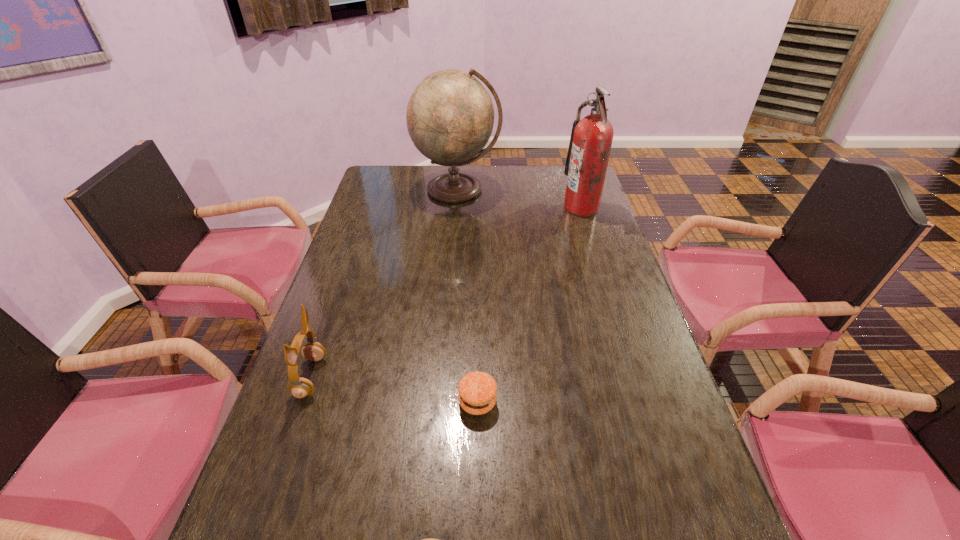
At what (x,y) coordinates should I click in order to perform the action: click on globe. Please return your answer as a coordinate pair (x, y). The image size is (960, 540). Looking at the image, I should click on (450, 115).

At what (x,y) coordinates should I click in order to perform the action: click on the rightmost object. Please return your answer as a coordinate pair (x, y). This screenshot has height=540, width=960. Looking at the image, I should click on (591, 139).

Locate an element on the screen. The height and width of the screenshot is (540, 960). the leftmost object is located at coordinates (300, 387).

Image resolution: width=960 pixels, height=540 pixels. What are the coordinates of `earphone` in the screenshot? It's located at (300, 387).

At what (x,y) coordinates should I click in order to perform the action: click on the taller patty. Please return your answer as a coordinate pair (x, y). The image size is (960, 540). Looking at the image, I should click on (477, 390).

This screenshot has height=540, width=960. What are the coordinates of `the second shortest object` in the screenshot? It's located at (477, 390).

You are a GUI agent. You are given a task and a screenshot of the screen. Output one action in this format:
    pyautogui.click(x=<x>, y=<y>)
    Task: Click on the vacant space positioned 0.300m on the front-facing side of the globe
    Image resolution: width=960 pixels, height=540 pixels.
    Given the screenshot: What is the action you would take?
    pyautogui.click(x=452, y=262)

You are a GUI agent. You are given a task and a screenshot of the screen. Output one action in this format:
    pyautogui.click(x=<x>, y=<y>)
    Task: Click on the vacant area located on the front of the rightmost object near the operation label
    
    Given the screenshot: What is the action you would take?
    pyautogui.click(x=518, y=207)

Find the location of a particular element. free spot located on the front of the rightmost object near the operation label is located at coordinates pos(457,207).

Identify the location of vacant point located 0.290m on the front of the rightmost object near the operation label. (486, 207).